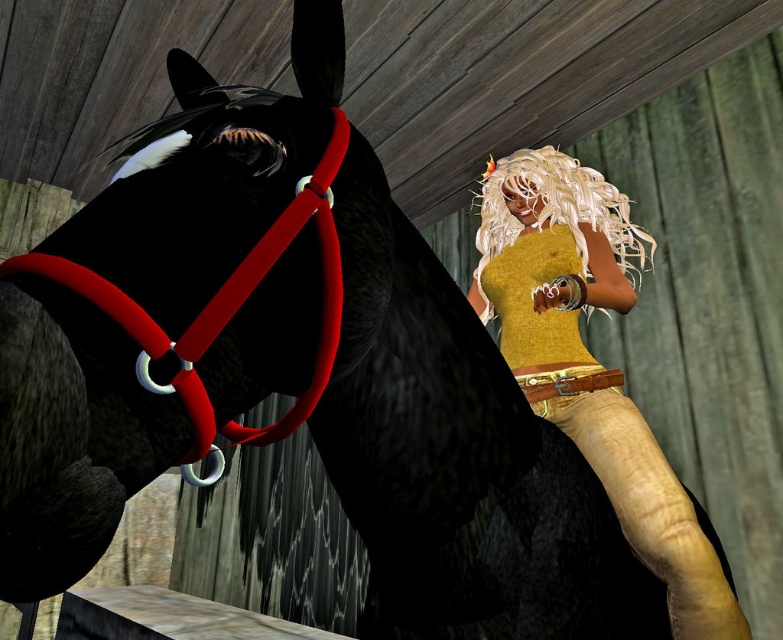
You are a photographer setting up a shoot in a barn. You notice the matte yellow tank top at center and the blonde hair wig at upper right. Which object is closer to the left side of the scene?

The matte yellow tank top at center is positioned on the left side of the blonde hair wig at upper right, so it is closer to the left side of the scene.

You are standing in a stable and want to approach the person riding the black horse. The person is located at point (565,355). If you can move forward 5 feet, will you be close enough to the person to hand them a water bottle?

The distance between you and the person at point (565,355) is 5.79 feet. Since you can move forward 5 feet, you will still be 0.79 feet away, so you won t be close enough to hand them the water bottle.

You are an artist trying to paint the scene. You need to decide which object to paint first based on their sizes. Since you want to paint the larger object first, which one should you choose between the matte yellow tank top at center and the blonde hair wig at upper right?

The matte yellow tank top at center is bigger than the blonde hair wig at upper right, so you should paint the matte yellow tank top at center first.